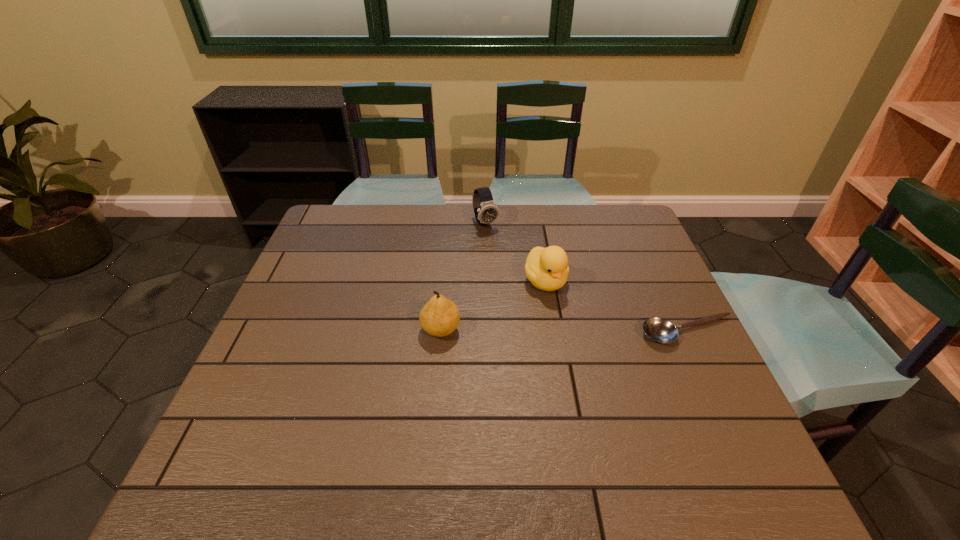
Where is `vacant space that is in between the second farthest object and the watch`? The image size is (960, 540). vacant space that is in between the second farthest object and the watch is located at coordinates (516, 252).

Find the location of a particular element. This screenshot has width=960, height=540. vacant point located between the rightmost object and the leftmost object is located at coordinates (564, 331).

At what (x,y) coordinates should I click in order to perform the action: click on the third closest object to the pear. Please return your answer as a coordinate pair (x, y). The width and height of the screenshot is (960, 540). Looking at the image, I should click on click(660, 330).

Locate an element on the screen. Image resolution: width=960 pixels, height=540 pixels. object that is the second closest to the third nearest object is located at coordinates (485, 209).

Where is `free space that satisfies the following two spatial constraints: 1. on the front side of the duck; 2. on the left side of the farthest object`? This screenshot has height=540, width=960. free space that satisfies the following two spatial constraints: 1. on the front side of the duck; 2. on the left side of the farthest object is located at coordinates (487, 281).

Find the location of a particular element. The image size is (960, 540). vacant position in the image that satisfies the following two spatial constraints: 1. on the front side of the shortest object; 2. on the right side of the duck is located at coordinates (554, 332).